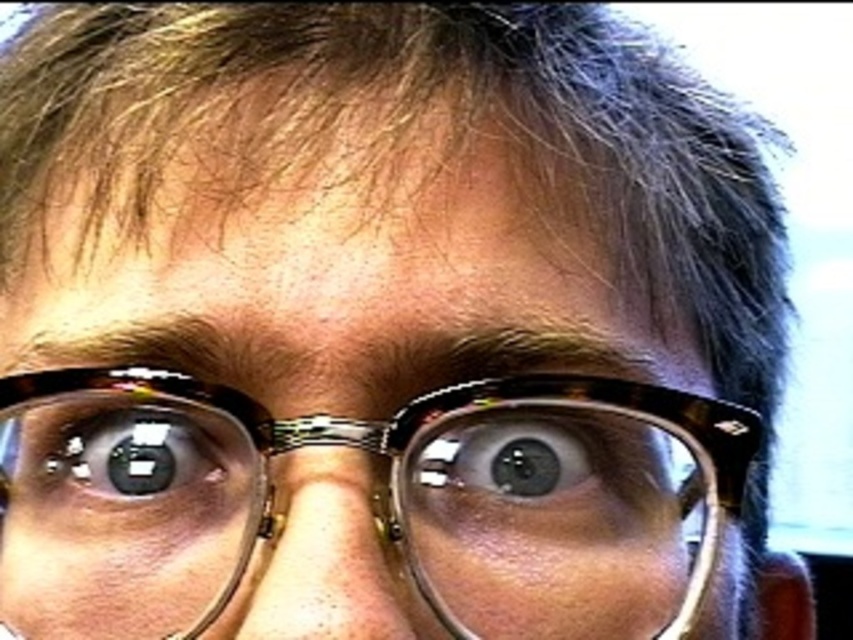
Question: Which point appears farthest from the camera in this image?

Choices:
 (A) (212, 470)
 (B) (323, 492)
 (C) (567, 572)
 (D) (476, 433)

Answer: (A)

Question: Is tortoiseshell frame glasses at center below matte plastic nose at center?

Choices:
 (A) no
 (B) yes

Answer: (A)

Question: Which point appears farthest from the camera in this image?

Choices:
 (A) (502, 442)
 (B) (105, 490)
 (C) (311, 525)

Answer: (B)

Question: Can you confirm if tortoiseshell frame glasses at center is positioned below brown glossy eye at center?

Choices:
 (A) no
 (B) yes

Answer: (B)

Question: Which object is closer to the camera taking this photo?

Choices:
 (A) matte plastic nose at center
 (B) brown glossy eye at center
 (C) tortoiseshell frame glasses at center
 (D) matte black eye at center

Answer: (A)

Question: Can you confirm if tortoiseshell frame glasses at center is thinner than matte black eye at center?

Choices:
 (A) yes
 (B) no

Answer: (B)